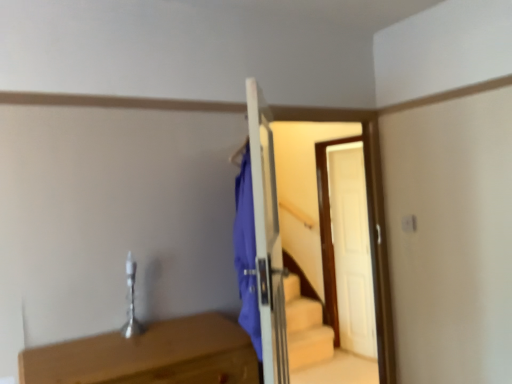
You are a GUI agent. You are given a task and a screenshot of the screen. Output one action in this format:
    pyautogui.click(x=<x>, y=<y>)
    Task: Click on the empty space that is ontop of light brown wooden table at lower left (from a real-world perspective)
    Image resolution: width=512 pixels, height=384 pixels.
    Given the screenshot: What is the action you would take?
    pyautogui.click(x=141, y=339)